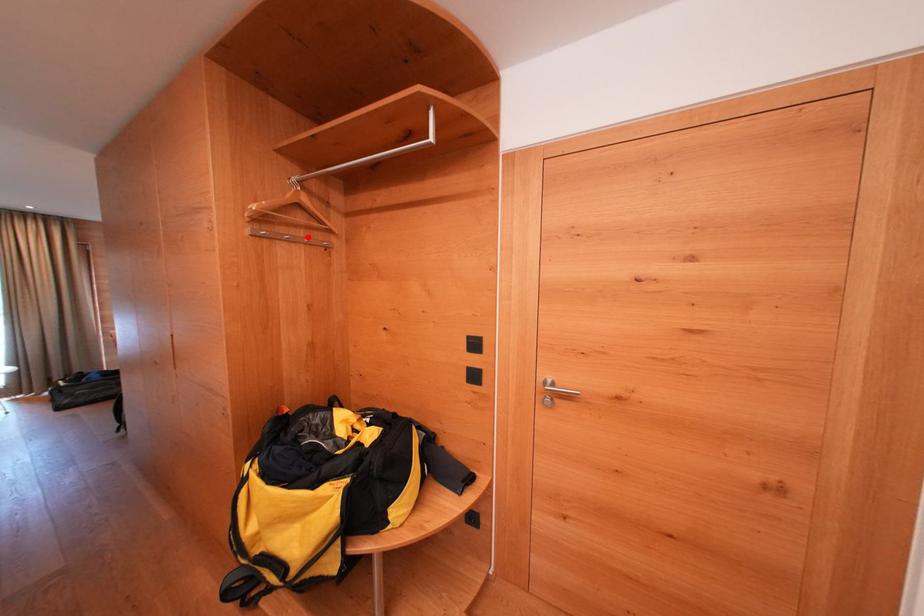
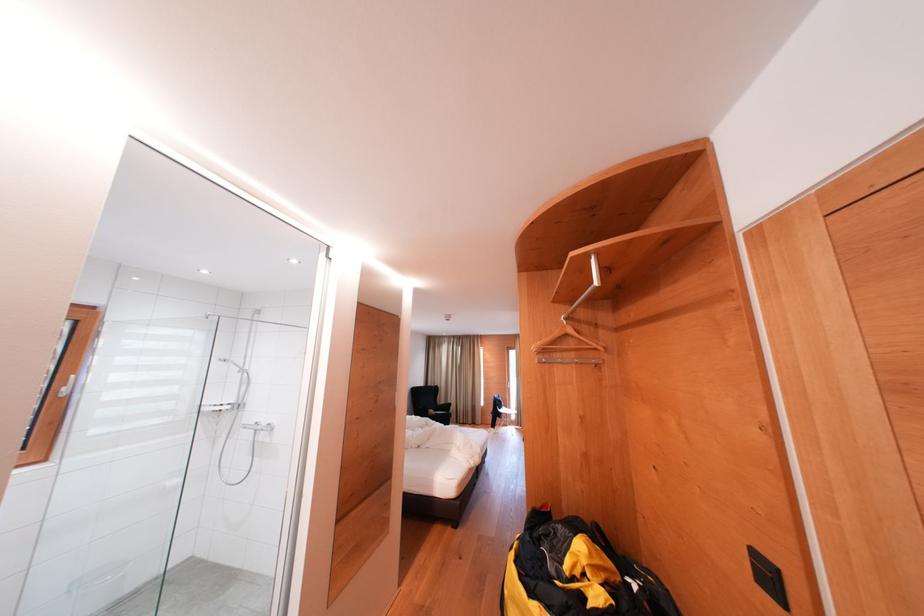
The point at the highlighted location is marked in the first image. Where is the corresponding point in the second image?

(579, 359)